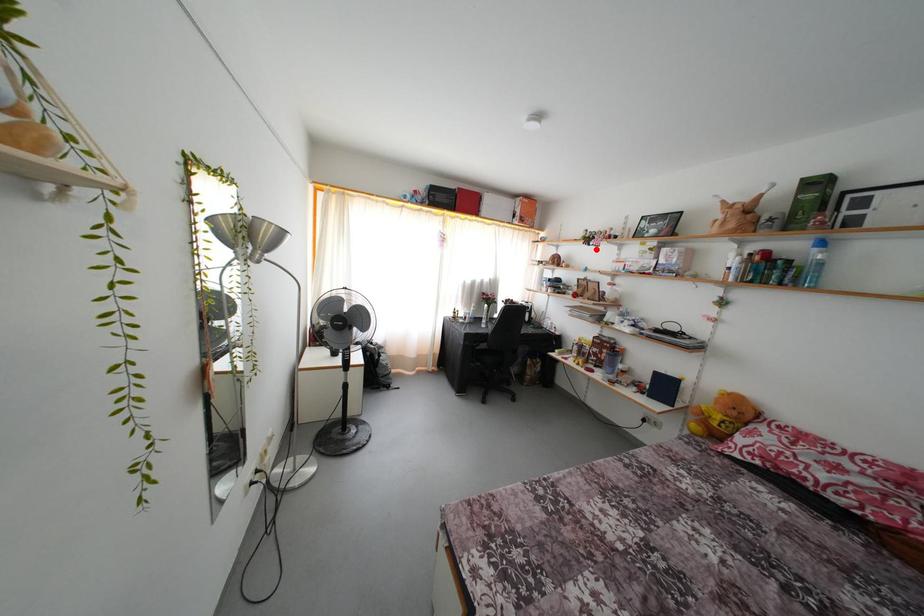
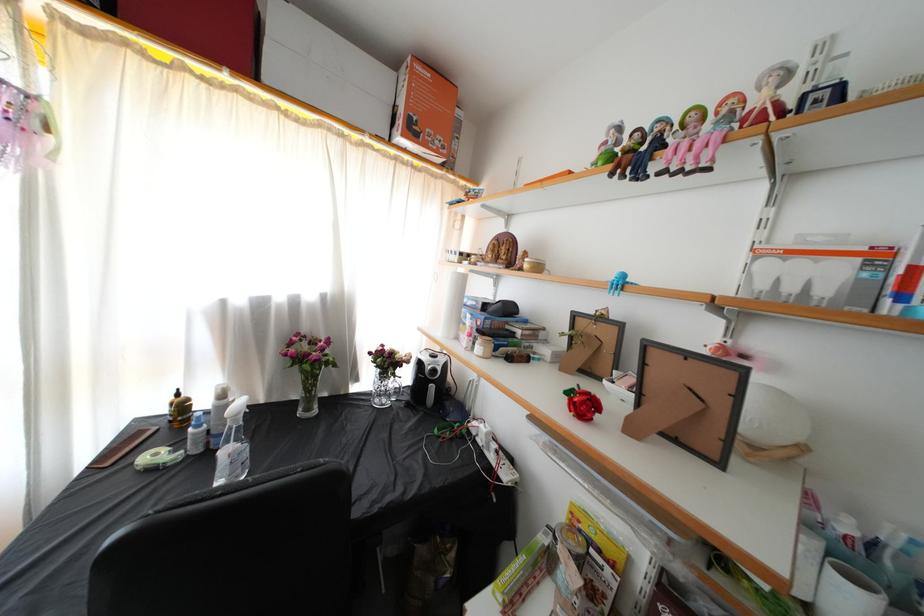
Question: A red point is marked in image1. In image2, is the corresponding 3D point closer to the camera or farther? Reply with the corresponding letter.

Choices:
 (A) The corresponding 3D point is closer.
 (B) The corresponding 3D point is farther.

Answer: (B)